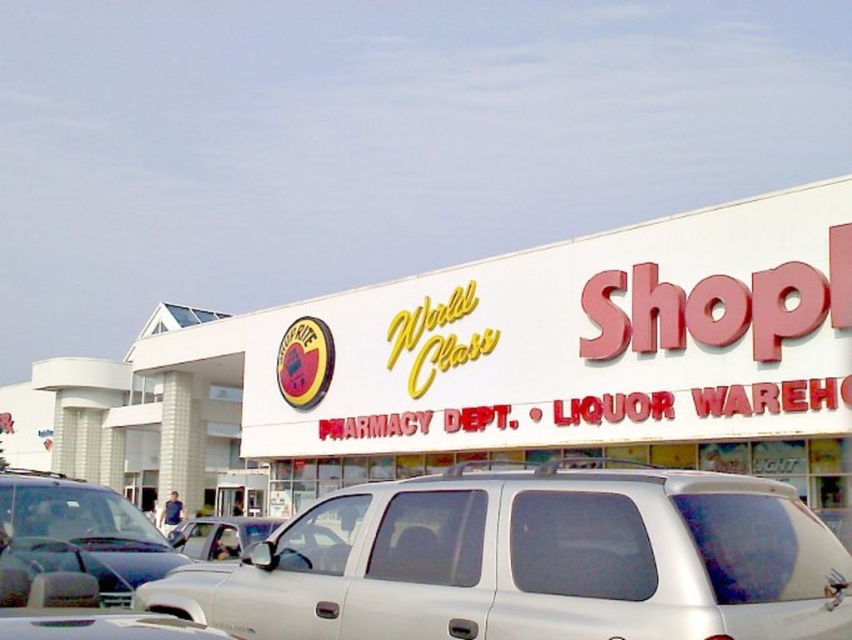
Based on the scene description, where is the point located at coordinates (458, 374)?

The point at coordinates (458, 374) is located on the white matte building at center.

Based on the photo, you are a delivery driver who needs to park your white matte minivan at center in front of the white matte building at center. Given that the building is wider than the minivan, can you safely park the minivan so that it fully fits within the building? Explain your reasoning.

The white matte building at center is wider than the white matte minivan at center, so yes, the minivan can be parked within the building as it is narrower than the building.